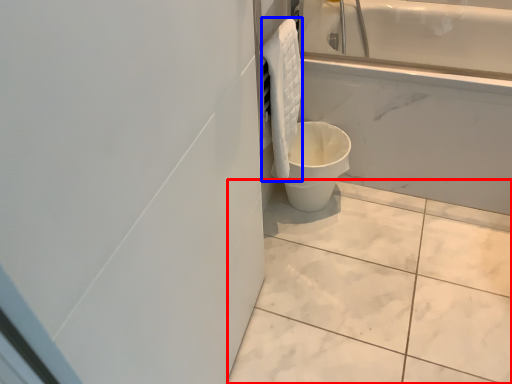
Question: Which point is closer to the camera, ceramic tile (highlighted by a red box) or material (highlighted by a blue box)?

Choices:
 (A) ceramic tile
 (B) material

Answer: (A)